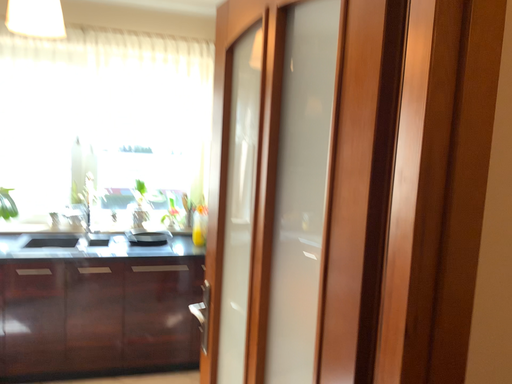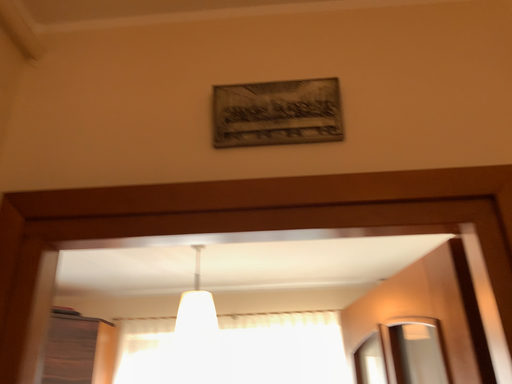
Question: How did the camera likely rotate when shooting the video?

Choices:
 (A) rotated left
 (B) rotated right

Answer: (A)